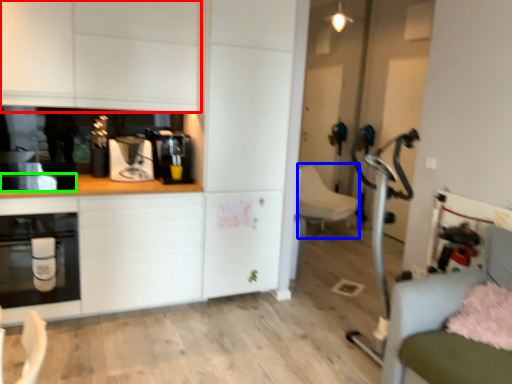
Question: Estimate the real-world distances between objects in this image. Which object is farther from cabinetry (highlighted by a red box), swivel chair (highlighted by a blue box) or appliance (highlighted by a green box)?

Choices:
 (A) swivel chair
 (B) appliance

Answer: (A)